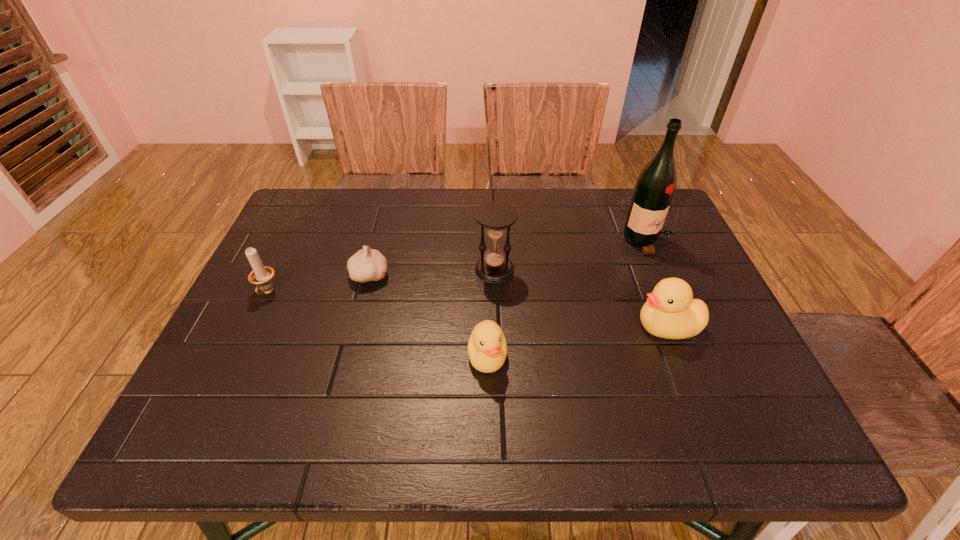
Locate an element on the screen. The height and width of the screenshot is (540, 960). object present at the far right corner is located at coordinates (656, 184).

You are a GUI agent. You are given a task and a screenshot of the screen. Output one action in this format:
    pyautogui.click(x=<x>, y=<y>)
    Task: Click on the blank space at the far edge of the desktop
    This screenshot has width=960, height=540.
    Given the screenshot: What is the action you would take?
    pyautogui.click(x=508, y=191)

The width and height of the screenshot is (960, 540). What are the coordinates of `free space at the near edge of the desktop` in the screenshot? It's located at (413, 368).

Where is `vacant space at the left edge of the desktop`? The image size is (960, 540). vacant space at the left edge of the desktop is located at coordinates (318, 238).

Identify the location of vacant space at the right edge of the desktop. (659, 266).

This screenshot has height=540, width=960. I want to click on vacant space at the far left corner of the desktop, so click(x=345, y=188).

This screenshot has height=540, width=960. Identify the location of vacant area at the near left corner of the desktop. (255, 405).

Locate an element on the screen. Image resolution: width=960 pixels, height=540 pixels. free spot between the leftmost object and the right duck is located at coordinates (468, 309).

Where is `vacant space that is in between the tallest object and the hourglass`? Image resolution: width=960 pixels, height=540 pixels. vacant space that is in between the tallest object and the hourglass is located at coordinates (571, 255).

Find the location of a particular element. Image resolution: width=960 pixels, height=540 pixels. empty location between the leftmost object and the fifth shortest object is located at coordinates (381, 281).